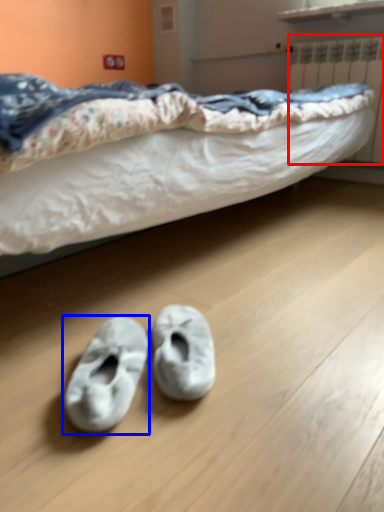
Question: Which of the following is the closest to the observer, radiator (highlighted by a red box) or footwear (highlighted by a blue box)?

Choices:
 (A) radiator
 (B) footwear

Answer: (B)